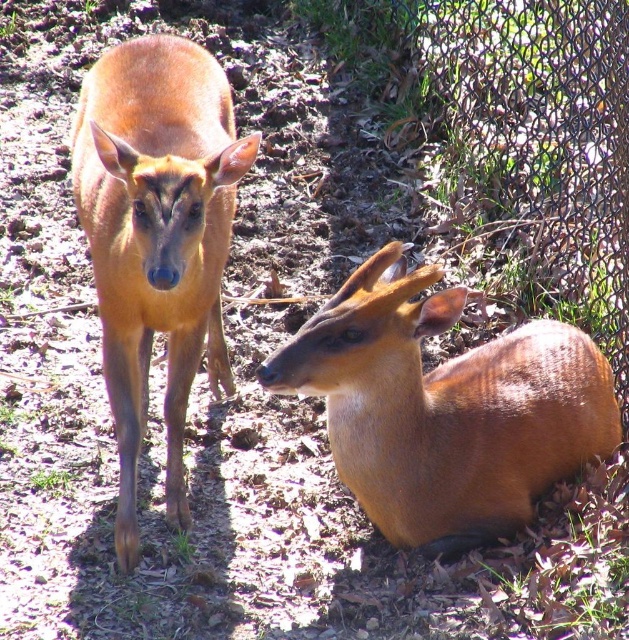
You are a zookeeper who needs to place a feeding station for the brown matte antelope at lower right. According to the coordinates provided, where should you position the feeding station relative to the enclosure?

The feeding station should be positioned at point (443, 406) relative to the enclosure to ensure it is accessible to the brown matte antelope at lower right.

You are standing in the enclosure with the two deer. You want to feed the brown matte antelope at lower right but need to stay at least 10 feet away for safety. Can you safely feed it from your current position?

The brown matte antelope at lower right and the viewer are 8.14 feet apart, which is less than the required 10 feet safety distance. Therefore, you cannot safely feed it from your current position.

You are a zookeeper observing two brown matte antelopes in their enclosure. You notice the brown matte antelope at lower right and the brown matte antelope at left. Based on their positions, which one is closer to the ground?

The brown matte antelope at lower right is closer to the ground because it is positioned below the brown matte antelope at left.